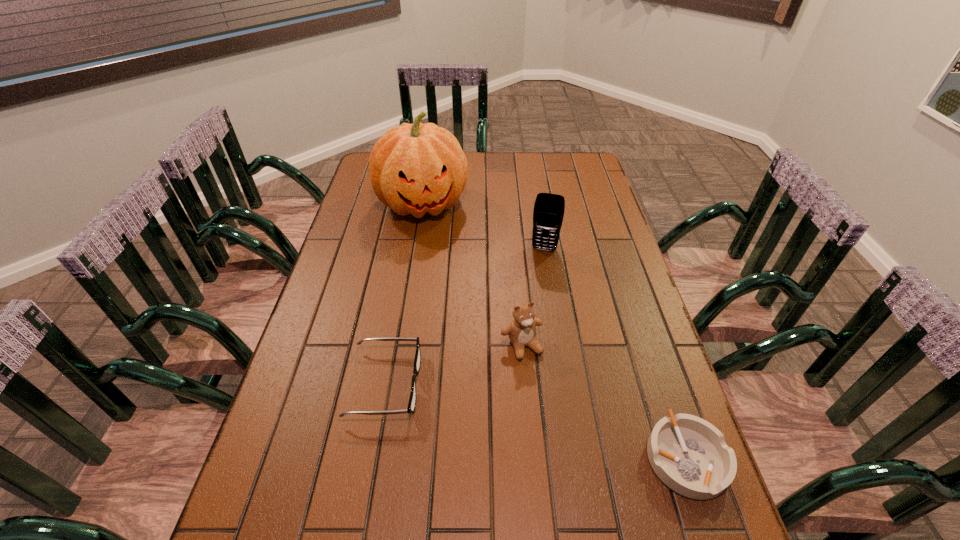
The image size is (960, 540). What are the coordinates of `free space on the desktop that is between the spectacles and the shortest object and is positioned on the carved face of the pumpkin` in the screenshot? It's located at (484, 408).

The height and width of the screenshot is (540, 960). Find the location of `vacant space on the desktop that is between the second shortest object and the shortest object and is positioned on the front-facing side of the third tallest object`. vacant space on the desktop that is between the second shortest object and the shortest object and is positioned on the front-facing side of the third tallest object is located at coordinates (563, 427).

Find the location of `free space on the desktop that is between the second shortest object and the shortest object and is positioned on the screen of the second farthest object`. free space on the desktop that is between the second shortest object and the shortest object and is positioned on the screen of the second farthest object is located at coordinates (508, 414).